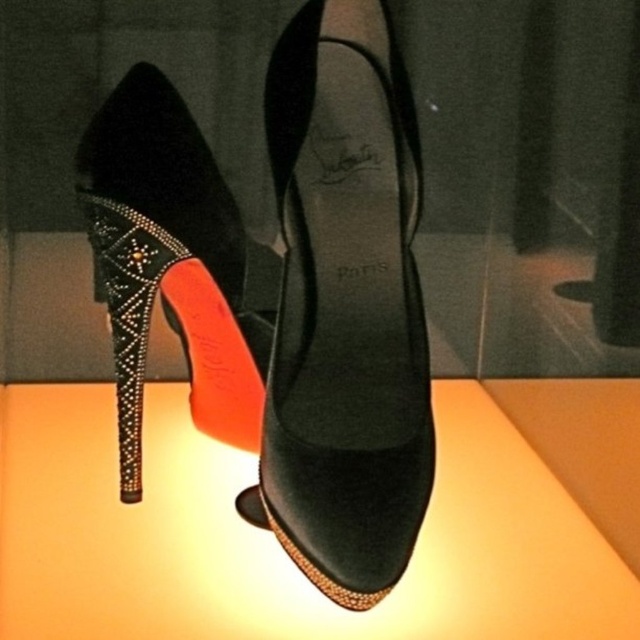
Is the position of velvet high-heeled shoe at center more distant than that of satin black shoe at center?

That is False.

Is velvet high-heeled shoe at center bigger than satin black shoe at center?

Indeed, velvet high-heeled shoe at center has a larger size compared to satin black shoe at center.

What do you see at coordinates (344, 308) in the screenshot? I see `velvet high-heeled shoe at center` at bounding box center [344, 308].

You are a GUI agent. You are given a task and a screenshot of the screen. Output one action in this format:
    pyautogui.click(x=<x>, y=<y>)
    Task: Click on the velvet high-heeled shoe at center
    The height and width of the screenshot is (640, 640).
    Given the screenshot: What is the action you would take?
    pyautogui.click(x=344, y=308)